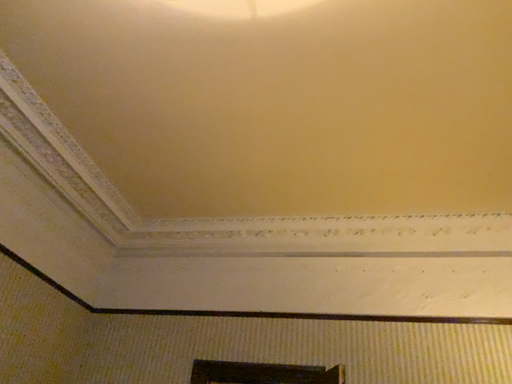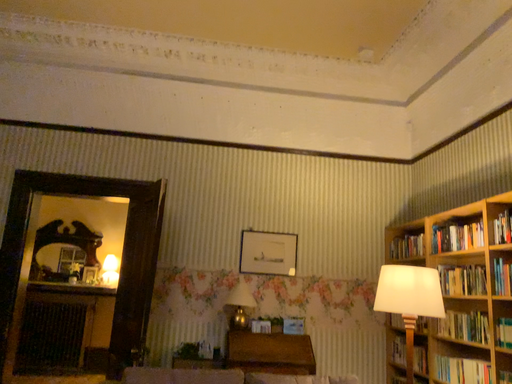
Question: Which way did the camera rotate in the video?

Choices:
 (A) rotated right
 (B) rotated left

Answer: (A)